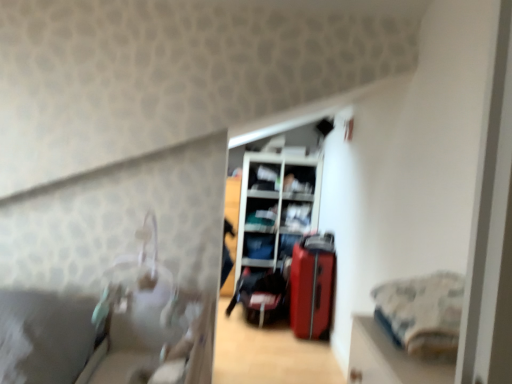
What do you see at coordinates (422, 312) in the screenshot? The image size is (512, 384). I see `fluffy cotton blanket at right` at bounding box center [422, 312].

What are the coordinates of `matte black suitcase at center, which is counted as the 1th luggage, starting from the left` in the screenshot? It's located at coord(261,295).

The width and height of the screenshot is (512, 384). What do you see at coordinates (298, 180) in the screenshot? I see `matte white shelf at upper center, which is the 2th shelf in top-to-bottom order` at bounding box center [298, 180].

This screenshot has width=512, height=384. I want to click on metallic silver shelf at center, the 4th shelf from the top, so click(297, 217).

At what (x,y) coordinates should I click in order to perform the action: click on fluffy cotton blanket at right. Please return your answer as a coordinate pair (x, y). This screenshot has width=512, height=384. Looking at the image, I should click on (422, 312).

Between matte white shelf at center, marked as the 3th shelf in a top-to-bottom arrangement, and shiny red suitcase at center, positioned as the 2th luggage in left-to-right order, which one has larger size?

shiny red suitcase at center, positioned as the 2th luggage in left-to-right order.

Which is less distant, [271,223] or [316,277]?

The point [316,277] is closer to the camera.

Is matte white shelf at center, acting as the third shelf starting from the bottom, thinner than shiny red suitcase at center, positioned as the 2th luggage in left-to-right order?

No, matte white shelf at center, acting as the third shelf starting from the bottom, is not thinner than shiny red suitcase at center, positioned as the 2th luggage in left-to-right order.

Which is less distant, (241, 290) or (264, 185)?

Point (241, 290) is positioned closer to the camera compared to point (264, 185).

Is matte black suitcase at center, which is counted as the 1th luggage, starting from the left, to the right of metallic silver suitcase at center from the viewer's perspective?

No, matte black suitcase at center, which is counted as the 1th luggage, starting from the left, is not to the right of metallic silver suitcase at center.

Is matte black suitcase at center, the second luggage in the right-to-left sequence, bigger than metallic silver suitcase at center?

No, matte black suitcase at center, the second luggage in the right-to-left sequence, is not bigger than metallic silver suitcase at center.

Considering their positions, is metallic silver suitcase at center located in front of or behind matte white shelf at center, which is counted as the 1th shelf, starting from the top?

Clearly, metallic silver suitcase at center is in front of matte white shelf at center, which is counted as the 1th shelf, starting from the top.

Between metallic silver suitcase at center and matte white shelf at center, which is counted as the 1th shelf, starting from the top, which one has more height?

metallic silver suitcase at center.

Consider the image. Is metallic silver suitcase at center looking in the opposite direction of matte white shelf at center, which is counted as the 1th shelf, starting from the top?

Yes, metallic silver suitcase at center's orientation is away from matte white shelf at center, which is counted as the 1th shelf, starting from the top.

Where is `shelf that is the 1st object above the metallic silver shelf at center, the 4th shelf from the top (from a real-world perspective)`? shelf that is the 1st object above the metallic silver shelf at center, the 4th shelf from the top (from a real-world perspective) is located at coordinates 298,180.

How different are the orientations of metallic silver shelf at center, the 4th shelf from the top, and matte white shelf at upper center, which is the 2th shelf in top-to-bottom order, in degrees?

The angle between the facing direction of metallic silver shelf at center, the 4th shelf from the top, and the facing direction of matte white shelf at upper center, which is the 2th shelf in top-to-bottom order, is 0.00467 degrees.

Is metallic silver shelf at center, which is the second shelf in bottom-to-top order, smaller than matte white shelf at upper center, which is the 4th shelf in bottom-to-top order?

Incorrect, metallic silver shelf at center, which is the second shelf in bottom-to-top order, is not smaller in size than matte white shelf at upper center, which is the 4th shelf in bottom-to-top order.

Considering the relative sizes of metallic silver shelf at center, which is the second shelf in bottom-to-top order, and matte white shelf at upper center, which is the 2th shelf in top-to-bottom order, in the image provided, is metallic silver shelf at center, which is the second shelf in bottom-to-top order, taller than matte white shelf at upper center, which is the 2th shelf in top-to-bottom order,?

Yes, metallic silver shelf at center, which is the second shelf in bottom-to-top order, is taller than matte white shelf at upper center, which is the 2th shelf in top-to-bottom order.

Who is shorter, metallic silver suitcase at center or fluffy cotton blanket at right?

fluffy cotton blanket at right.

Does point (273, 204) come closer to viewer compared to point (386, 288)?

No.

Considering the relative positions of metallic silver suitcase at center and fluffy cotton blanket at right in the image provided, is metallic silver suitcase at center to the left of fluffy cotton blanket at right from the viewer's perspective?

Yes.

From a real-world perspective, is metallic silver suitcase at center above or below fluffy cotton blanket at right?

In terms of real-world spatial position, metallic silver suitcase at center is below fluffy cotton blanket at right.

From the image's perspective, between matte black suitcase at center, which is counted as the 1th luggage, starting from the left, and metallic silver shelf at center, which is the second shelf in bottom-to-top order, who is located below?

matte black suitcase at center, which is counted as the 1th luggage, starting from the left, appears lower in the image.

Considering the sizes of matte black suitcase at center, the second luggage in the right-to-left sequence, and metallic silver shelf at center, which is the second shelf in bottom-to-top order, in the image, is matte black suitcase at center, the second luggage in the right-to-left sequence, wider or thinner than metallic silver shelf at center, which is the second shelf in bottom-to-top order,?

In the image, matte black suitcase at center, the second luggage in the right-to-left sequence, appears to be wider than metallic silver shelf at center, which is the second shelf in bottom-to-top order.

From a real-world perspective, is matte black suitcase at center, the second luggage in the right-to-left sequence, located beneath metallic silver shelf at center, the 4th shelf from the top?

Yes, from a real-world perspective, matte black suitcase at center, the second luggage in the right-to-left sequence, is under metallic silver shelf at center, the 4th shelf from the top.

Looking at this image, is matte black suitcase at center, the second luggage in the right-to-left sequence, outside of metallic silver shelf at center, the 4th shelf from the top?

Indeed, matte black suitcase at center, the second luggage in the right-to-left sequence, is completely outside metallic silver shelf at center, the 4th shelf from the top.

Considering the points (302, 264) and (315, 221), which point is behind, point (302, 264) or point (315, 221)?

Positioned behind is point (315, 221).

Can you tell me how much shiny red suitcase at center, positioned as the 2th luggage in left-to-right order, and metallic silver suitcase at center differ in facing direction?

There is a 87.8-degree angle between the facing directions of shiny red suitcase at center, positioned as the 2th luggage in left-to-right order, and metallic silver suitcase at center.

Is shiny red suitcase at center, arranged as the 1th luggage when viewed from the right, next to metallic silver suitcase at center?

No.

You are a GUI agent. You are given a task and a screenshot of the screen. Output one action in this format:
    pyautogui.click(x=<x>, y=<y>)
    Task: Click on the luggage that is the 2nd one when counting forward from the metallic silver suitcase at center
    
    Given the screenshot: What is the action you would take?
    pyautogui.click(x=312, y=285)

At what (x,y) coordinates should I click in order to perform the action: click on luggage that is the 1st object directly below the matte white shelf at center, acting as the third shelf starting from the bottom (from a real-world perspective). Please return your answer as a coordinate pair (x, y). Looking at the image, I should click on coord(312,285).

From the image's perspective, which luggage is the 2nd one below the metallic silver suitcase at center? Please provide its 2D coordinates.

[(261, 295)]

Estimate the real-world distances between objects in this image. Which object is further from fluffy cotton blanket at right, matte black shelf at center, the first shelf ordered from the bottom, or matte white shelf at upper center, which is the 4th shelf in bottom-to-top order?

matte white shelf at upper center, which is the 4th shelf in bottom-to-top order, is further to fluffy cotton blanket at right.

Considering their positions, is matte white shelf at center, the fifth shelf ordered from the bottom, positioned further to fluffy cotton blanket at right than matte black shelf at center, the first shelf ordered from the bottom?

matte white shelf at center, the fifth shelf ordered from the bottom, is positioned further to the anchor fluffy cotton blanket at right.

Consider the image. When comparing their distances from matte white shelf at center, which is counted as the 1th shelf, starting from the top, does shiny red suitcase at center, arranged as the 1th luggage when viewed from the right, or matte white shelf at center, marked as the 3th shelf in a top-to-bottom arrangement, seem further?

shiny red suitcase at center, arranged as the 1th luggage when viewed from the right, lies further to matte white shelf at center, which is counted as the 1th shelf, starting from the top, than the other object.

Estimate the real-world distances between objects in this image. Which object is closer to metallic silver suitcase at center, fluffy cotton blanket at right or matte white shelf at center, acting as the third shelf starting from the bottom?

matte white shelf at center, acting as the third shelf starting from the bottom, lies closer to metallic silver suitcase at center than the other object.

When comparing their distances from matte white shelf at center, which is counted as the 1th shelf, starting from the top, does shiny red suitcase at center, arranged as the 1th luggage when viewed from the right, or fluffy cotton blanket at right seem further?

Among the two, fluffy cotton blanket at right is located further to matte white shelf at center, which is counted as the 1th shelf, starting from the top.

When comparing their distances from fluffy cotton blanket at right, does matte white shelf at upper center, which is the 4th shelf in bottom-to-top order, or shiny red suitcase at center, positioned as the 2th luggage in left-to-right order, seem closer?

shiny red suitcase at center, positioned as the 2th luggage in left-to-right order.

Looking at the image, which one is located further to matte black suitcase at center, the second luggage in the right-to-left sequence, metallic silver suitcase at center or metallic silver shelf at center, the 4th shelf from the top?

Among the two, metallic silver shelf at center, the 4th shelf from the top, is located further to matte black suitcase at center, the second luggage in the right-to-left sequence.

Estimate the real-world distances between objects in this image. Which object is closer to shiny red suitcase at center, arranged as the 1th luggage when viewed from the right, matte black shelf at center, arranged as the fifth shelf when viewed from the top, or matte white shelf at center, marked as the 3th shelf in a top-to-bottom arrangement?

matte black shelf at center, arranged as the fifth shelf when viewed from the top, lies closer to shiny red suitcase at center, arranged as the 1th luggage when viewed from the right, than the other object.

Find the location of a particular element. locker between matte white shelf at center, the fifth shelf ordered from the bottom, and matte black suitcase at center, which is counted as the 1th luggage, starting from the left, vertically is located at coordinates (276, 207).

At what (x,y) coordinates should I click in order to perform the action: click on locker between fluffy cotton blanket at right and matte black shelf at center, arranged as the fifth shelf when viewed from the top, along the z-axis. Please return your answer as a coordinate pair (x, y). The image size is (512, 384). Looking at the image, I should click on (276, 207).

Locate an element on the screen. This screenshot has width=512, height=384. locker located between fluffy cotton blanket at right and matte white shelf at center, which is counted as the 1th shelf, starting from the top, in the depth direction is located at coordinates pos(276,207).

What are the coordinates of `locker between shiny red suitcase at center, positioned as the 2th luggage in left-to-right order, and matte black shelf at center, arranged as the fifth shelf when viewed from the top, along the z-axis` in the screenshot? It's located at point(276,207).